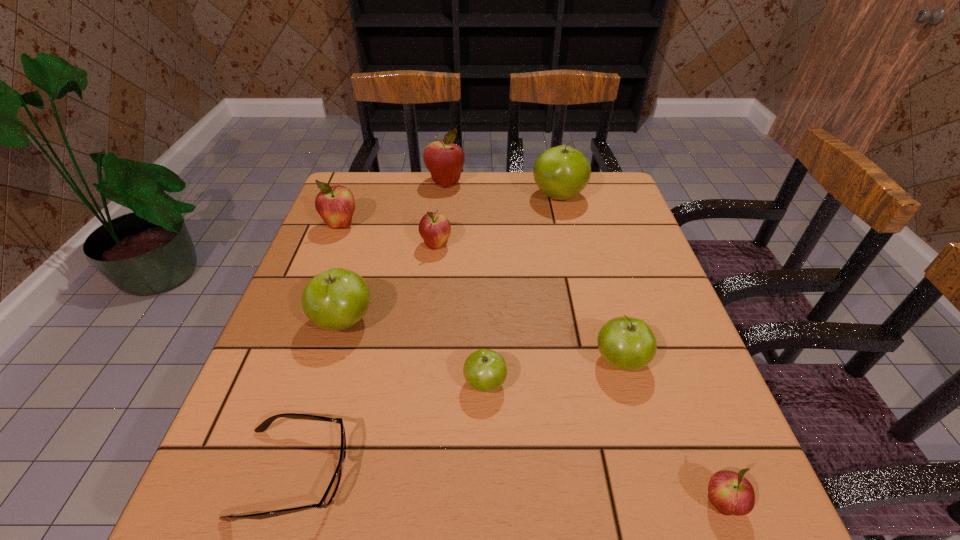
Where is `apple that is at the near edge`? The height and width of the screenshot is (540, 960). apple that is at the near edge is located at coordinates (730, 493).

At what (x,y) coordinates should I click in order to perform the action: click on spectacles that is at the near edge. Please return your answer as a coordinate pair (x, y). The image size is (960, 540). Looking at the image, I should click on (330, 493).

You are a GUI agent. You are given a task and a screenshot of the screen. Output one action in this format:
    pyautogui.click(x=<x>, y=<y>)
    Task: Click on the spectacles positioned at the left edge
    The height and width of the screenshot is (540, 960).
    Given the screenshot: What is the action you would take?
    pyautogui.click(x=330, y=493)

You are a GUI agent. You are given a task and a screenshot of the screen. Output one action in this format:
    pyautogui.click(x=<x>, y=<y>)
    Task: Click on the object present at the far left corner
    This screenshot has height=540, width=960.
    Given the screenshot: What is the action you would take?
    pyautogui.click(x=335, y=204)

Find the location of a particular element. object at the near left corner is located at coordinates (330, 493).

Where is `object located in the far right corner section of the desktop`? The height and width of the screenshot is (540, 960). object located in the far right corner section of the desktop is located at coordinates (562, 172).

At what (x,y) coordinates should I click in order to perform the action: click on object present at the near right corner. Please return your answer as a coordinate pair (x, y). Looking at the image, I should click on (730, 493).

Image resolution: width=960 pixels, height=540 pixels. Find the location of `vacant region at the far edge`. vacant region at the far edge is located at coordinates (500, 192).

Image resolution: width=960 pixels, height=540 pixels. Find the location of `vacant space at the near edge of the desktop`. vacant space at the near edge of the desktop is located at coordinates (423, 481).

This screenshot has height=540, width=960. I want to click on vacant space at the left edge of the desktop, so click(309, 269).